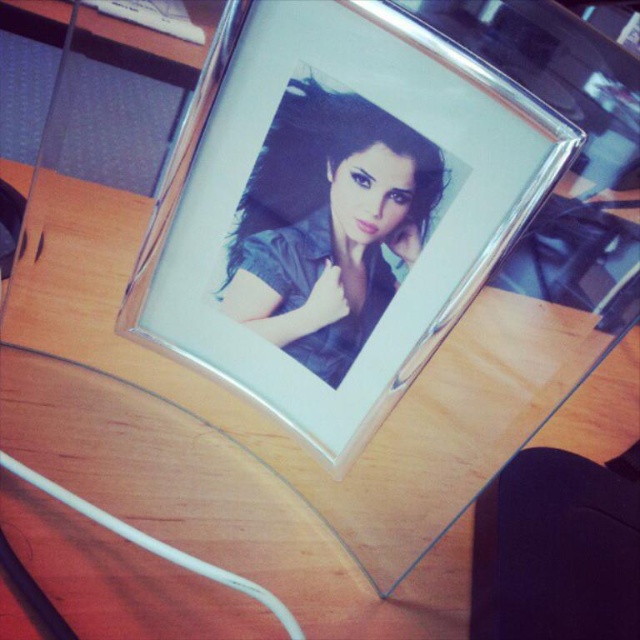
What do you see at coordinates (339, 209) in the screenshot? I see `silver metallic photo frame at center` at bounding box center [339, 209].

Where is `silver metallic photo frame at center`? silver metallic photo frame at center is located at coordinates (339, 209).